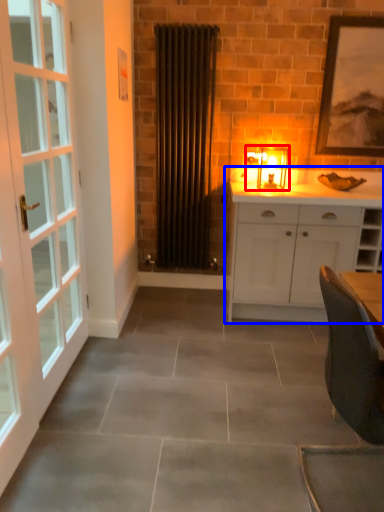
Question: Which object appears closest to the camera in this image, light fixture (highlighted by a red box) or cabinetry (highlighted by a blue box)?

Choices:
 (A) light fixture
 (B) cabinetry

Answer: (B)